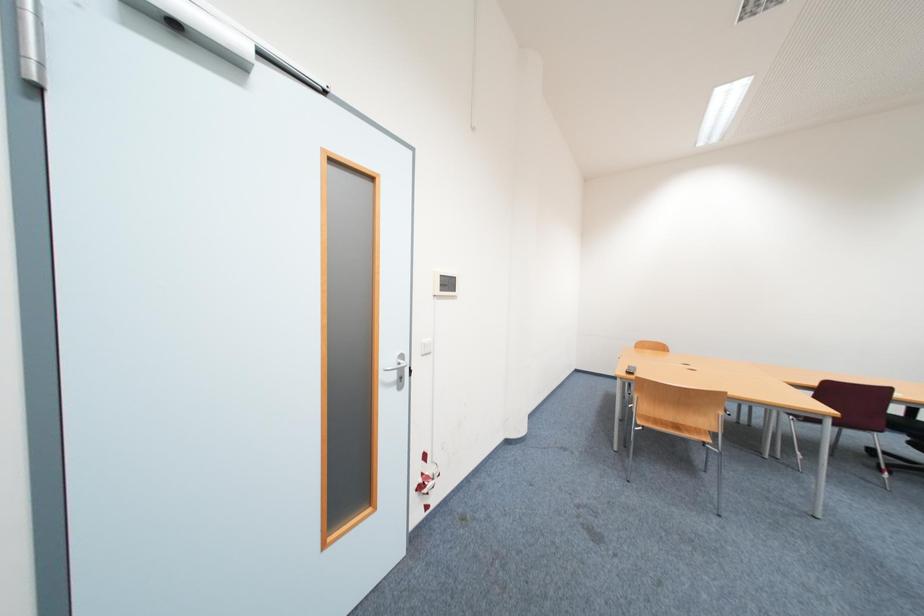
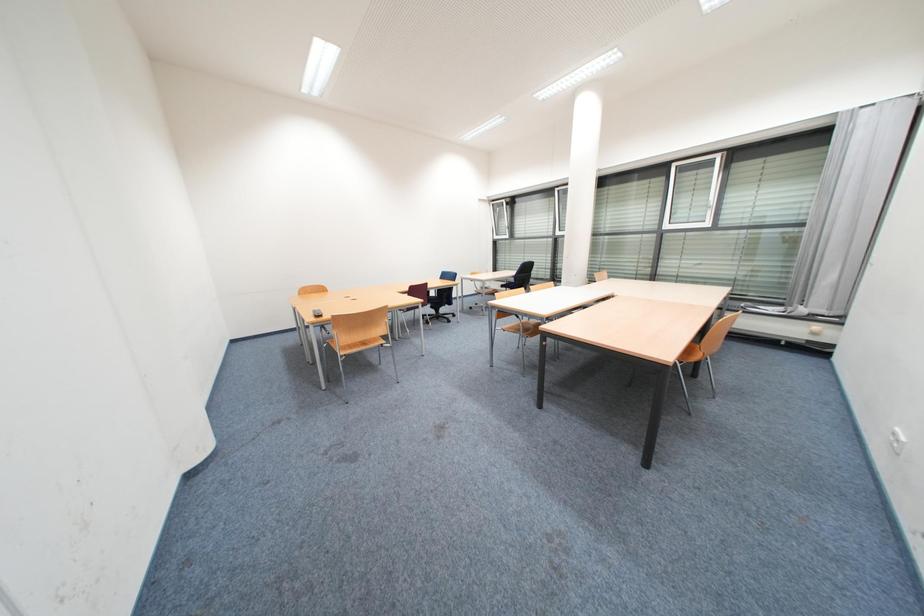
The images are taken continuously from a first-person perspective. In which direction is your viewpoint rotating?

The camera's rotation is toward right-down.